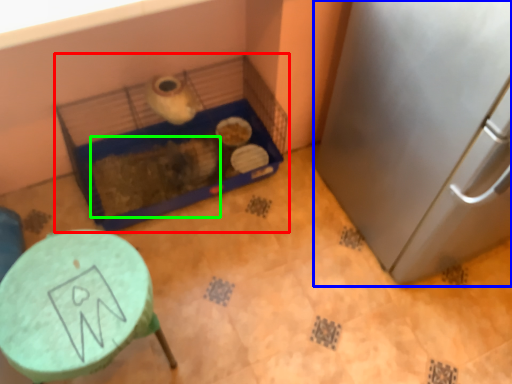
Question: Considering the real-world distances, which object is farthest from bird cage (highlighted by a red box)? appliance (highlighted by a blue box) or animal (highlighted by a green box)?

Choices:
 (A) appliance
 (B) animal

Answer: (A)